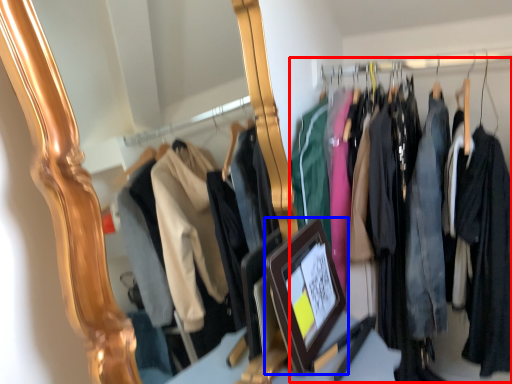
Question: Which point is closer to the camera, closet (highlighted by a red box) or picture frame (highlighted by a blue box)?

Choices:
 (A) closet
 (B) picture frame

Answer: (B)